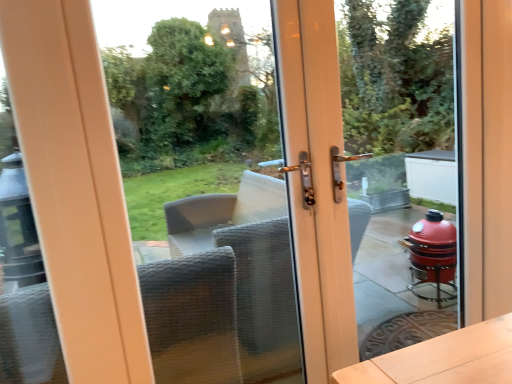
Question: Would you say transparent glass door at center is part of transparent glass door at center's contents?

Choices:
 (A) yes
 (B) no

Answer: (B)

Question: Is transparent glass door at center shorter than transparent glass door at center?

Choices:
 (A) yes
 (B) no

Answer: (B)

Question: Is transparent glass door at center at the right side of transparent glass door at center?

Choices:
 (A) no
 (B) yes

Answer: (A)

Question: Can you confirm if transparent glass door at center is bigger than transparent glass door at center?

Choices:
 (A) yes
 (B) no

Answer: (A)

Question: From a real-world perspective, is transparent glass door at center positioned under transparent glass door at center based on gravity?

Choices:
 (A) no
 (B) yes

Answer: (B)

Question: From a real-world perspective, does transparent glass door at center stand above transparent glass door at center?

Choices:
 (A) no
 (B) yes

Answer: (A)

Question: From a real-world perspective, does transparent glass door at center stand above transparent glass door at center?

Choices:
 (A) no
 (B) yes

Answer: (B)

Question: Can you see transparent glass door at center touching transparent glass door at center?

Choices:
 (A) yes
 (B) no

Answer: (B)

Question: Can you confirm if transparent glass door at center is positioned to the left of transparent glass door at center?

Choices:
 (A) no
 (B) yes

Answer: (A)

Question: Can you confirm if transparent glass door at center is positioned to the right of transparent glass door at center?

Choices:
 (A) no
 (B) yes

Answer: (B)

Question: Is transparent glass door at center thinner than transparent glass door at center?

Choices:
 (A) no
 (B) yes

Answer: (B)

Question: Is transparent glass door at center oriented towards transparent glass door at center?

Choices:
 (A) yes
 (B) no

Answer: (B)

Question: Considering the positions of point (150, 115) and point (415, 307), is point (150, 115) closer or farther from the camera than point (415, 307)?

Choices:
 (A) closer
 (B) farther

Answer: (B)